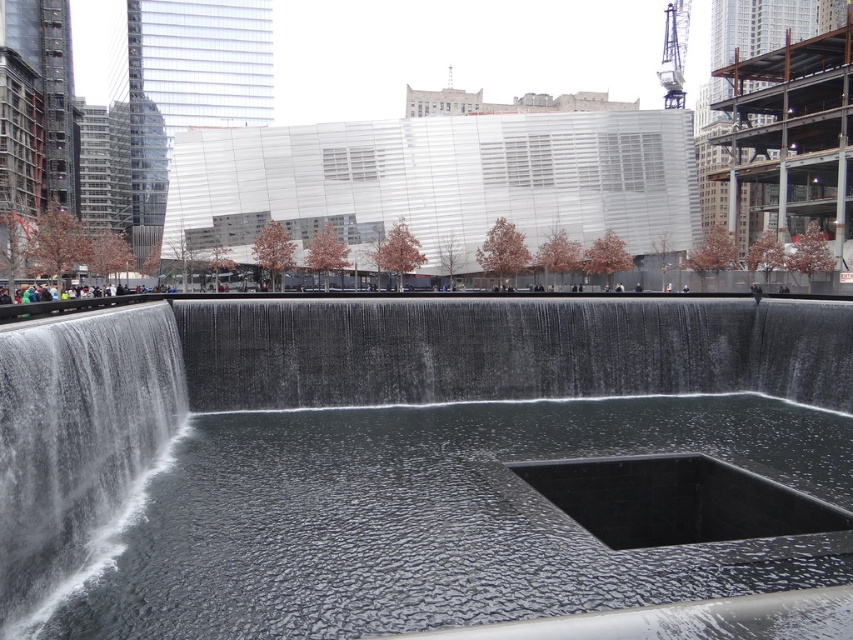
Question: Does clear water at center appear over white textured water at left?

Choices:
 (A) no
 (B) yes

Answer: (B)

Question: Where is black polished water at center located in relation to clear water at center in the image?

Choices:
 (A) right
 (B) left

Answer: (A)

Question: Which object is the farthest from the white textured water at left?

Choices:
 (A) clear water at center
 (B) black polished water at center

Answer: (A)

Question: Considering the relative positions of black polished water at center and clear water at center in the image provided, where is black polished water at center located with respect to clear water at center?

Choices:
 (A) right
 (B) left

Answer: (A)

Question: Based on their relative distances, which object is farther from the black polished water at center?

Choices:
 (A) white textured water at left
 (B) clear water at center

Answer: (A)

Question: Which of the following is the farthest from the observer?

Choices:
 (A) black polished water at center
 (B) white textured water at left
 (C) clear water at center

Answer: (C)